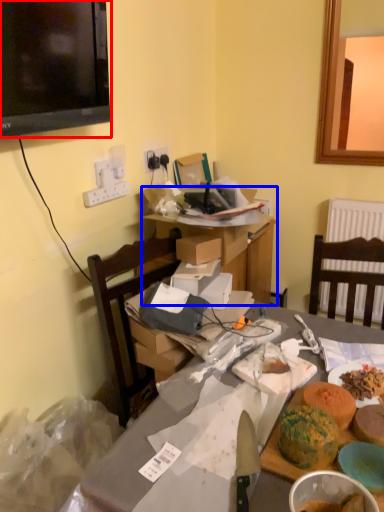
Question: Which object appears closest to the camera in this image, television (highlighted by a red box) or table (highlighted by a blue box)?

Choices:
 (A) television
 (B) table

Answer: (A)